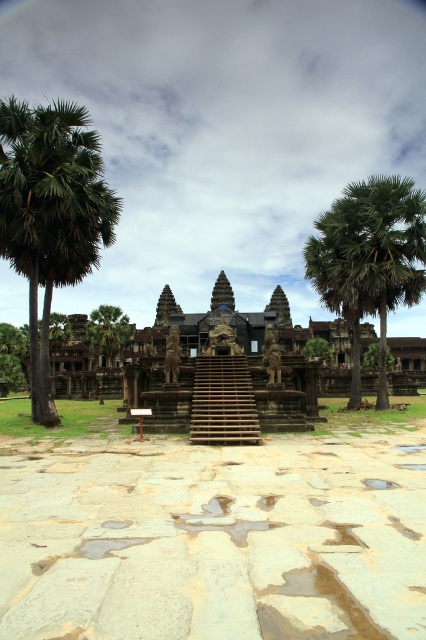
Who is lower down, green leafy palm tree at left or green leafy palm tree at right?

green leafy palm tree at right

Looking at this image, is green leafy palm tree at left to the right of green leafy palm tree at right from the viewer's perspective?

Incorrect, green leafy palm tree at left is not on the right side of green leafy palm tree at right.

Does point (6, 106) come in front of point (330, 268)?

Yes, point (6, 106) is closer to viewer.

You are a GUI agent. You are given a task and a screenshot of the screen. Output one action in this format:
    pyautogui.click(x=<x>, y=<y>)
    Task: Click on the green leafy palm tree at left
    
    Given the screenshot: What is the action you would take?
    [51, 212]